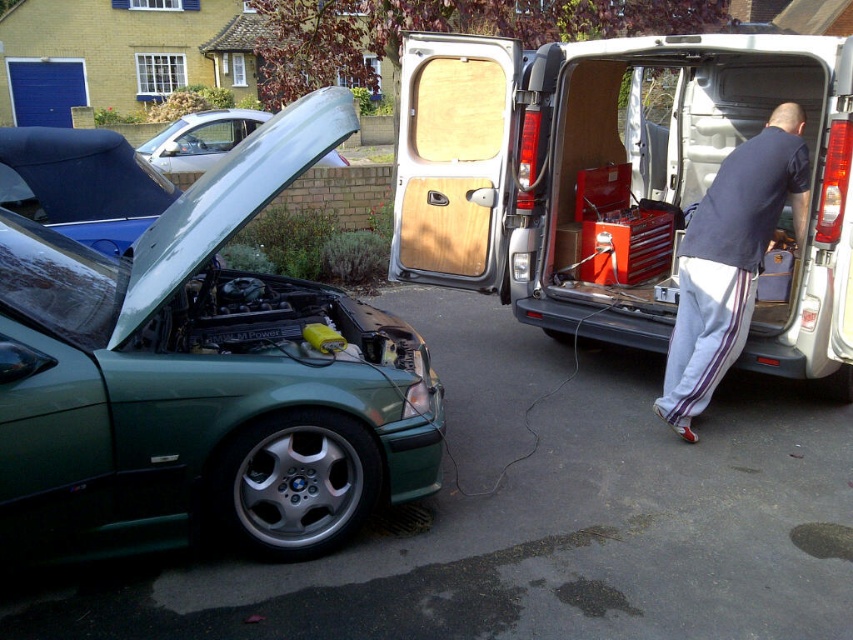
What object is located at the coordinates point (618,182) in the image?

The point (618,182) indicates the silver metallic van at right.

You are a mechanic with a 6.5 feet long ladder that you need to place between the green metallic car at left and the white van at right. Will the ladder fit between them?

The distance between the green metallic car at left and the white van at right is 8.23 feet. Since the ladder is 6.5 feet long, it will fit between them as 6.5 is less than 8.23.